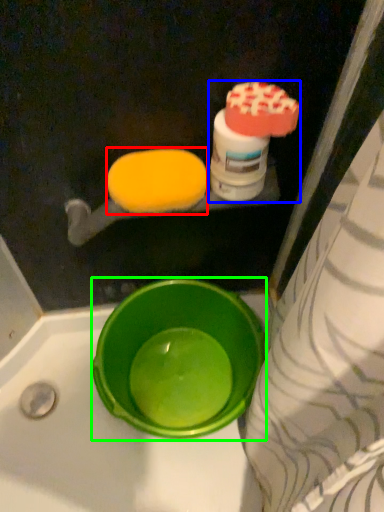
Question: Based on their relative distances, which object is farther from food (highlighted by a red box)? Choose from cleaning product (highlighted by a blue box) and basin (highlighted by a green box).

Choices:
 (A) cleaning product
 (B) basin

Answer: (B)